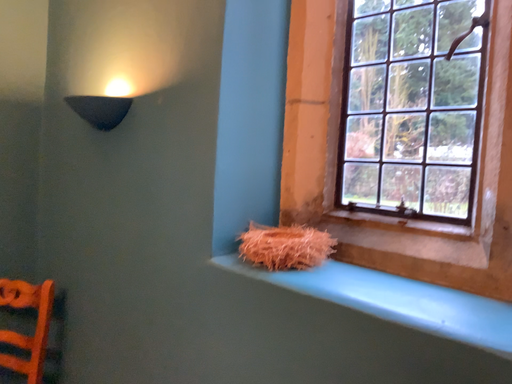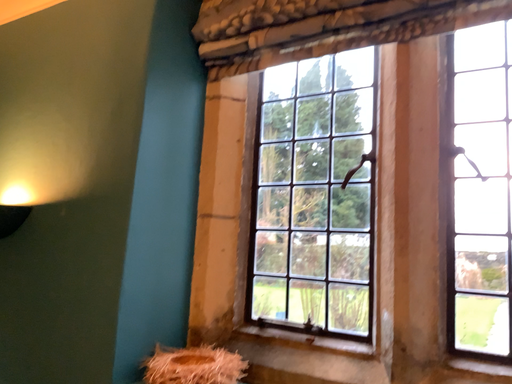
Question: Which way did the camera rotate in the video?

Choices:
 (A) rotated left
 (B) rotated right

Answer: (B)